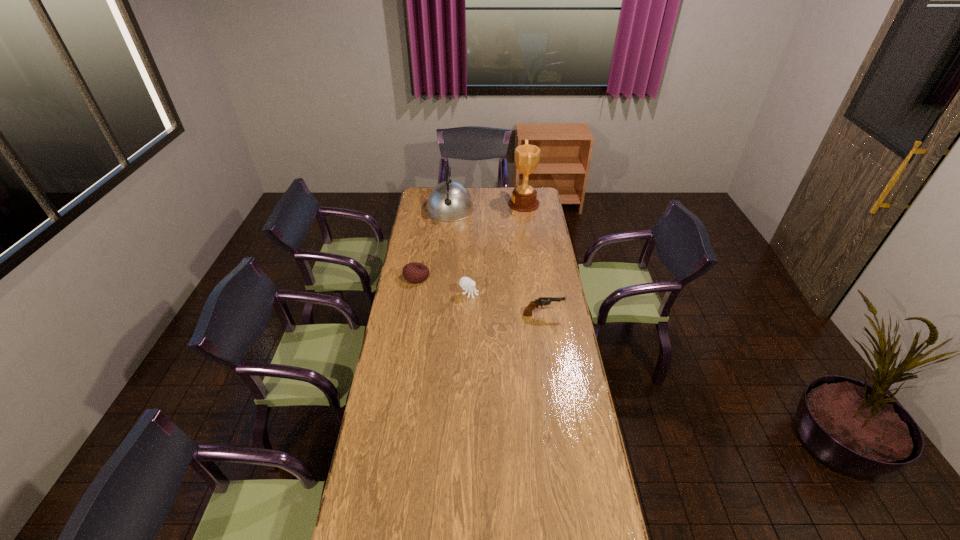
The width and height of the screenshot is (960, 540). Find the location of `free space that satisfies the following two spatial constraints: 1. on the front-facing side of the tallest object; 2. from the spout of the fourth shortest object`. free space that satisfies the following two spatial constraints: 1. on the front-facing side of the tallest object; 2. from the spout of the fourth shortest object is located at coordinates coord(524,209).